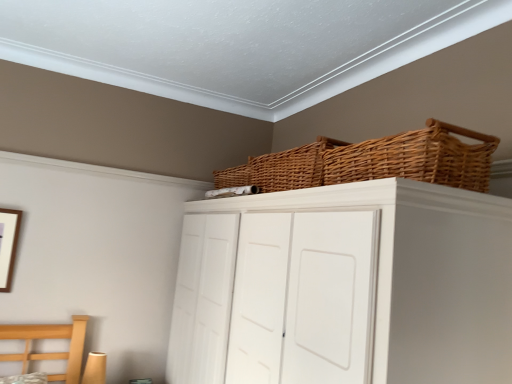
Question: Which direction should I rotate to look at woven brown basket at upper center, arranged as the second basket when viewed from the back?

Choices:
 (A) left
 (B) right

Answer: (B)

Question: From a real-world perspective, is woven brown basket at upper center, which ranks as the 1th basket in back-to-front order, located higher than white matte cupboard at upper center?

Choices:
 (A) no
 (B) yes

Answer: (B)

Question: From the image's perspective, is woven brown basket at upper center, which ranks as the 1th basket in back-to-front order, beneath white matte cupboard at upper center?

Choices:
 (A) no
 (B) yes

Answer: (A)

Question: Is woven brown basket at upper center, which ranks as the 1th basket in back-to-front order, not within white matte cupboard at upper center?

Choices:
 (A) no
 (B) yes

Answer: (B)

Question: Is woven brown basket at upper center, which ranks as the 1th basket in back-to-front order, wider than white matte cupboard at upper center?

Choices:
 (A) yes
 (B) no

Answer: (B)

Question: Considering the relative positions of woven brown basket at upper center, the 2th basket in the front-to-back sequence, and white matte cupboard at upper center in the image provided, is woven brown basket at upper center, the 2th basket in the front-to-back sequence, to the right of white matte cupboard at upper center from the viewer's perspective?

Choices:
 (A) no
 (B) yes

Answer: (B)

Question: Is woven brown basket at upper center, which ranks as the 1th basket in back-to-front order, aimed at white matte cupboard at upper center?

Choices:
 (A) no
 (B) yes

Answer: (A)

Question: Is white matte cupboard at upper center not within woven brown basket at upper center, positioned as the 1th basket in front-to-back order?

Choices:
 (A) yes
 (B) no

Answer: (A)

Question: Are white matte cupboard at upper center and woven brown basket at upper center, positioned as the 1th basket in front-to-back order, far apart?

Choices:
 (A) yes
 (B) no

Answer: (B)

Question: Considering the relative positions of white matte cupboard at upper center and woven brown basket at upper center, arranged as the second basket when viewed from the back, in the image provided, is white matte cupboard at upper center to the right of woven brown basket at upper center, arranged as the second basket when viewed from the back, from the viewer's perspective?

Choices:
 (A) yes
 (B) no

Answer: (B)

Question: From the image's perspective, is white matte cupboard at upper center located beneath woven brown basket at upper center, arranged as the second basket when viewed from the back?

Choices:
 (A) yes
 (B) no

Answer: (A)

Question: Considering the relative sizes of white matte cupboard at upper center and woven brown basket at upper center, positioned as the 1th basket in front-to-back order, in the image provided, is white matte cupboard at upper center thinner than woven brown basket at upper center, positioned as the 1th basket in front-to-back order,?

Choices:
 (A) yes
 (B) no

Answer: (B)

Question: Can you confirm if white matte cupboard at upper center is wider than woven brown basket at upper center, arranged as the second basket when viewed from the back?

Choices:
 (A) no
 (B) yes

Answer: (B)

Question: Is white matte cupboard at upper center at the right side of woven brown basket at upper center, which ranks as the 1th basket in back-to-front order?

Choices:
 (A) yes
 (B) no

Answer: (B)